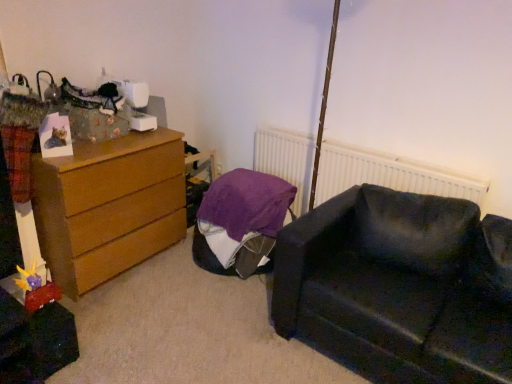
Question: Is white textured radiator at upper center turned away from plush yellow and purple toy at lower left?

Choices:
 (A) no
 (B) yes

Answer: (A)

Question: Is white textured radiator at upper center behind plush yellow and purple toy at lower left?

Choices:
 (A) no
 (B) yes

Answer: (B)

Question: Does white textured radiator at upper center appear on the right side of plush yellow and purple toy at lower left?

Choices:
 (A) yes
 (B) no

Answer: (A)

Question: Can you confirm if white textured radiator at upper center is shorter than plush yellow and purple toy at lower left?

Choices:
 (A) yes
 (B) no

Answer: (B)

Question: Is white textured radiator at upper center wider than plush yellow and purple toy at lower left?

Choices:
 (A) yes
 (B) no

Answer: (B)

Question: Is plush yellow and purple toy at lower left completely or partially inside white textured radiator at upper center?

Choices:
 (A) yes
 (B) no

Answer: (B)

Question: Considering the relative sizes of plush yellow and purple toy at lower left and white textured radiator at upper center in the image provided, is plush yellow and purple toy at lower left shorter than white textured radiator at upper center?

Choices:
 (A) no
 (B) yes

Answer: (B)

Question: From the image's perspective, is plush yellow and purple toy at lower left above white textured radiator at upper center?

Choices:
 (A) yes
 (B) no

Answer: (B)

Question: Does plush yellow and purple toy at lower left have a smaller size compared to white textured radiator at upper center?

Choices:
 (A) yes
 (B) no

Answer: (A)

Question: Is plush yellow and purple toy at lower left looking in the opposite direction of white textured radiator at upper center?

Choices:
 (A) no
 (B) yes

Answer: (A)

Question: Is plush yellow and purple toy at lower left aimed at white textured radiator at upper center?

Choices:
 (A) no
 (B) yes

Answer: (A)

Question: Does plush yellow and purple toy at lower left have a greater height compared to white textured radiator at upper center?

Choices:
 (A) yes
 (B) no

Answer: (B)

Question: Is dark fabric couch at lower right taller than wooden chest of drawers at left?

Choices:
 (A) yes
 (B) no

Answer: (B)